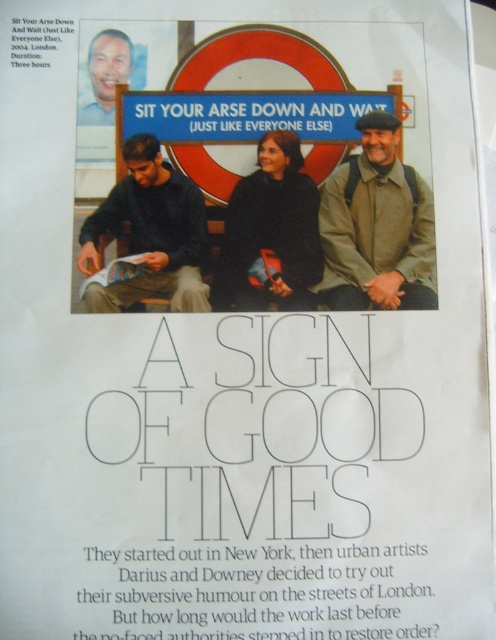
Question: Which object is positioned farthest from the matte paper magazine at center?

Choices:
 (A) black matte jacket at center
 (B) dark blue sweater at left
 (C) khaki fabric jacket at center

Answer: (C)

Question: Is the position of dark blue sweater at left more distant than that of matte paper magazine at center?

Choices:
 (A) yes
 (B) no

Answer: (B)

Question: Based on their relative distances, which object is nearer to the blue plastic sign at upper center?

Choices:
 (A) black matte jacket at center
 (B) matte black face at upper left

Answer: (A)

Question: Which point is closer to the camera taking this photo?

Choices:
 (A) (123, 61)
 (B) (118, 259)
 (C) (355, 243)
 (D) (166, 241)

Answer: (B)

Question: In this image, where is khaki fabric jacket at center located relative to dark blue sweater at left?

Choices:
 (A) above
 (B) below

Answer: (A)

Question: Can you confirm if blue plastic sign at upper center is thinner than matte black face at upper left?

Choices:
 (A) yes
 (B) no

Answer: (B)